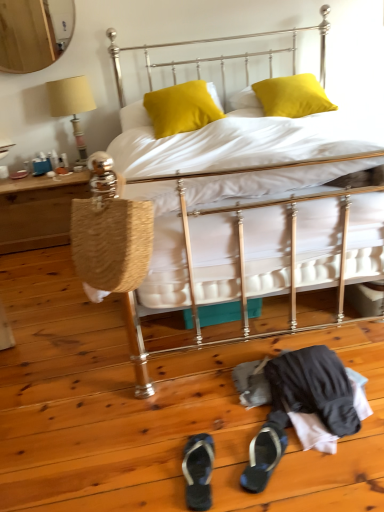
Question: From a real-world perspective, is satin yellow pillow at center, which ranks as the second pillow in right-to-left order, above or below matte yellow fabric lampshade at left?

Choices:
 (A) above
 (B) below

Answer: (A)

Question: From the image's perspective, is satin yellow pillow at center, which ranks as the second pillow in right-to-left order, positioned above or below matte yellow fabric lampshade at left?

Choices:
 (A) below
 (B) above

Answer: (B)

Question: Considering the real-world distances, which object is farthest from the metallic bed at center?

Choices:
 (A) woven straw bag at left
 (B) matte yellow fabric lampshade at left
 (C) dark gray fabric sandal at lower center, positioned as the first footwear in right-to-left order
 (D) woven wood table at left
 (E) blue fabric flip-flop at lower center, which is counted as the 2th footwear, starting from the right

Answer: (B)

Question: Considering the real-world distances, which object is closest to the dark gray fabric sandal at lower center, positioned as the first footwear in right-to-left order?

Choices:
 (A) metallic bed at center
 (B) satin yellow pillow at center, positioned as the first pillow in left-to-right order
 (C) woven straw bag at left
 (D) satin yellow pillow at upper center, which appears as the 2th pillow when viewed from the left
 (E) matte yellow fabric lampshade at left

Answer: (C)